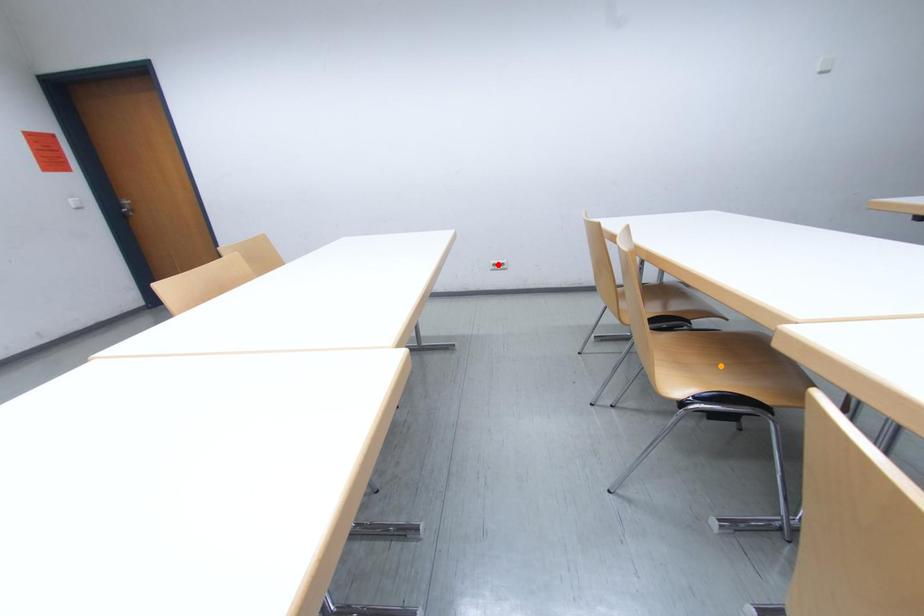
Order these from nearest to farthest:
orange point | green point | red point

orange point, green point, red point